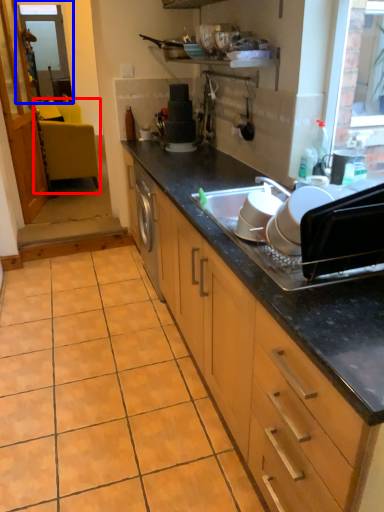
Question: Which object is closer to the camera taking this photo, chair (highlighted by a red box) or window screen (highlighted by a blue box)?

Choices:
 (A) chair
 (B) window screen

Answer: (A)